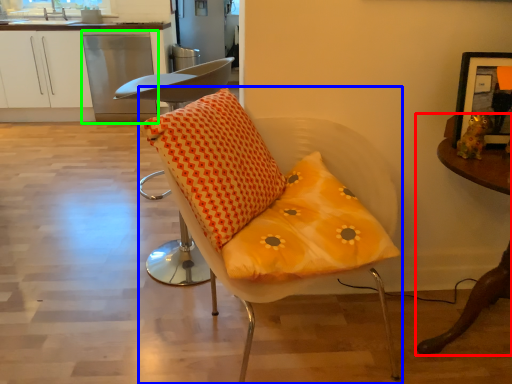
Question: Which is nearer to the table (highlighted by a red box)? chair (highlighted by a blue box) or dish washer (highlighted by a green box).

Choices:
 (A) chair
 (B) dish washer

Answer: (A)